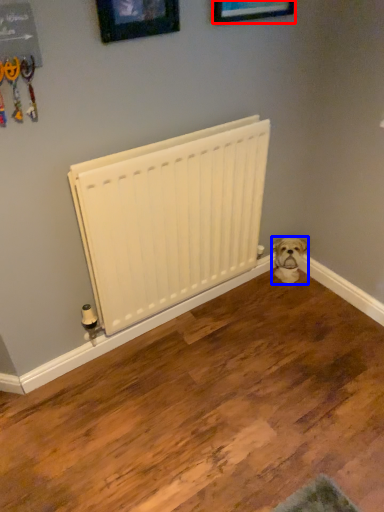
Question: Which point is further to the camera, picture frame (highlighted by a red box) or dog (highlighted by a blue box)?

Choices:
 (A) picture frame
 (B) dog

Answer: (B)